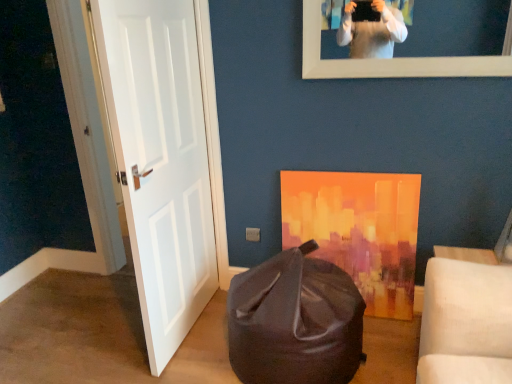
Identify the location of vacant space to the left of white matte door at left. (93, 336).